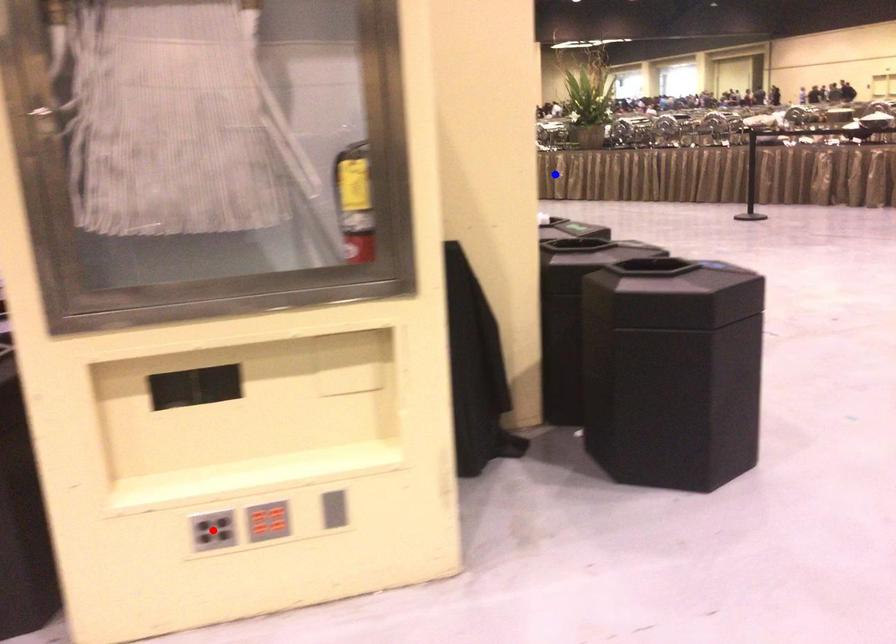
Question: Two points are marked on the image. Which point is closer to the camera?

Choices:
 (A) Blue point is closer.
 (B) Red point is closer.

Answer: (B)